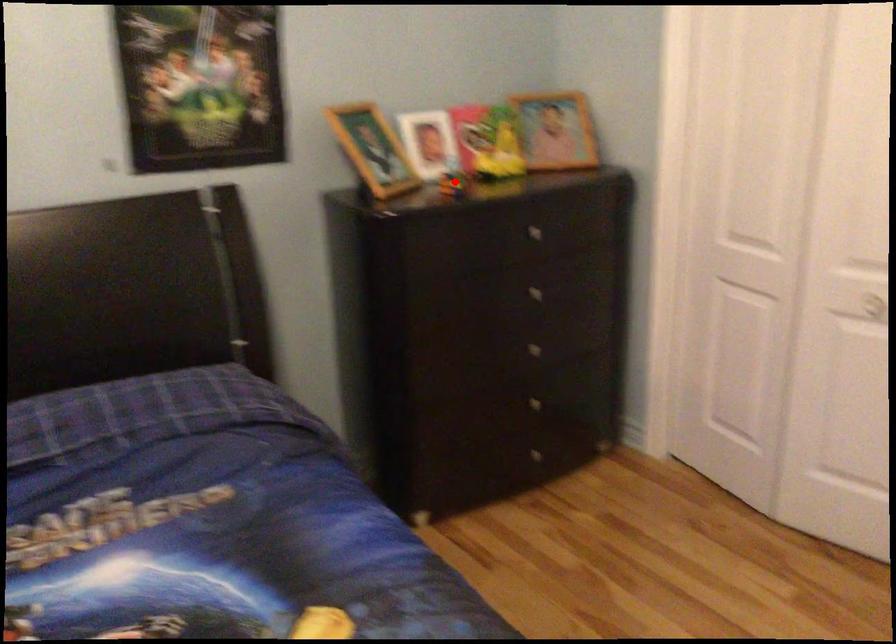
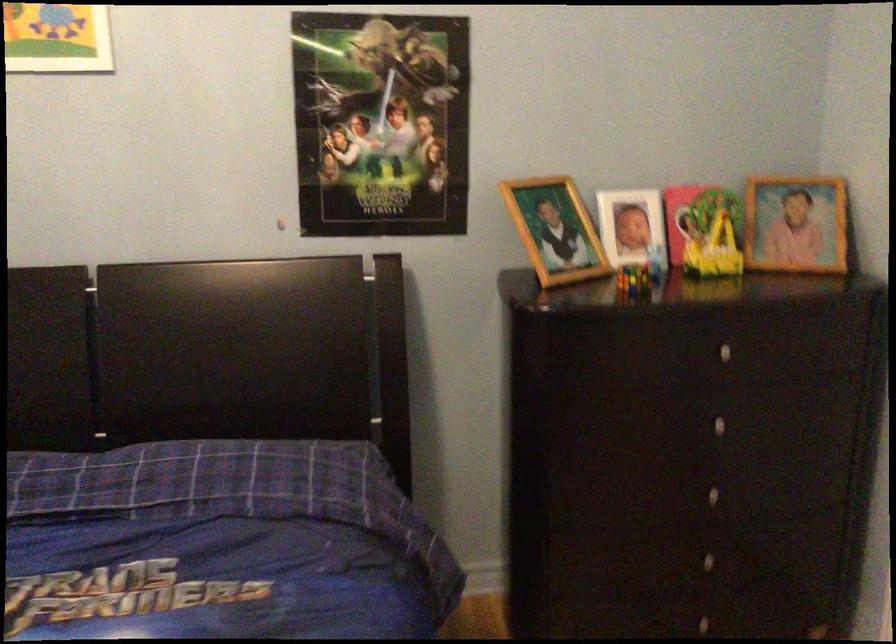
Find the pixel in the second image that matches the highlighted location in the first image.

(634, 279)